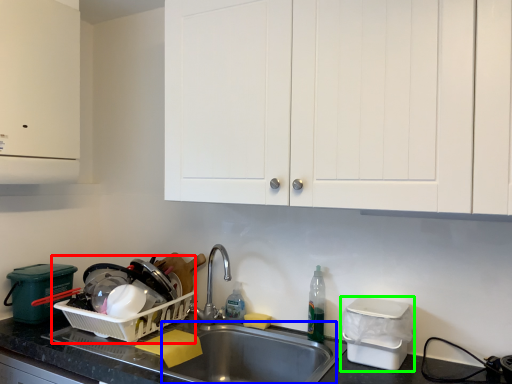
Question: Based on their relative distances, which object is farther from appliance (highlighted by a red box)? Choose from sink (highlighted by a blue box) and appliance (highlighted by a green box).

Choices:
 (A) sink
 (B) appliance

Answer: (B)